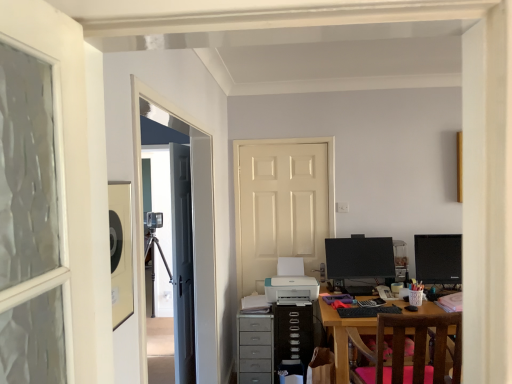
The width and height of the screenshot is (512, 384). Identify the location of white glossy door at center, acting as the second door starting from the left. (282, 207).

In order to face white glossy door at center, the first door viewed from the right, should I rotate leftwards or rightwards?

Rotate right and turn 3.976 degrees.

Find the location of a particular element. This screenshot has width=512, height=384. teal plastic printer at center is located at coordinates (291, 289).

What do you see at coordinates (182, 264) in the screenshot? This screenshot has height=384, width=512. I see `dark gray matte door at left, placed as the 2th door when sorted from right to left` at bounding box center [182, 264].

What do you see at coordinates (255, 349) in the screenshot?
I see `gray fabric drawer at center` at bounding box center [255, 349].

Locate an element on the screen. black glossy monitor at center, placed as the 2th computer monitor when sorted from right to left is located at coordinates (359, 261).

The image size is (512, 384). Describe the element at coordinates (359, 261) in the screenshot. I see `black glossy monitor at center, placed as the first computer monitor when sorted from left to right` at that location.

In order to face black glossy monitor at right, acting as the second computer monitor starting from the left, should I rotate leftwards or rightwards?

It's best to rotate right around 23.466 degrees.

Locate an element on the screen. white glossy door at center, the first door viewed from the right is located at coordinates (282, 207).

Is transparent glass door at upper left positioned far away from dark gray matte door at left, marked as the 1th door in a left-to-right arrangement?

No, transparent glass door at upper left is not far away from dark gray matte door at left, marked as the 1th door in a left-to-right arrangement.

Is transparent glass door at upper left closer to the viewer compared to dark gray matte door at left, placed as the 2th door when sorted from right to left?

Yes, transparent glass door at upper left is closer to the viewer.

Is transparent glass door at upper left at the left side of dark gray matte door at left, marked as the 1th door in a left-to-right arrangement?

No.

Is transparent glass door at upper left thinner than dark gray matte door at left, marked as the 1th door in a left-to-right arrangement?

In fact, transparent glass door at upper left might be wider than dark gray matte door at left, marked as the 1th door in a left-to-right arrangement.

Is white glossy door at center, the first door viewed from the right, facing away from black glossy monitor at center, placed as the 2th computer monitor when sorted from right to left?

white glossy door at center, the first door viewed from the right, is not turned away from black glossy monitor at center, placed as the 2th computer monitor when sorted from right to left.

Considering the relative positions of white glossy door at center, acting as the second door starting from the left, and black glossy monitor at center, placed as the first computer monitor when sorted from left to right, in the image provided, is white glossy door at center, acting as the second door starting from the left, to the right of black glossy monitor at center, placed as the first computer monitor when sorted from left to right, from the viewer's perspective?

No.

Identify the location of door behind the black glossy monitor at center, placed as the 2th computer monitor when sorted from right to left. (282, 207).

Where is `printer above the pink fabric chair at lower right (from a real-world perspective)`? The height and width of the screenshot is (384, 512). printer above the pink fabric chair at lower right (from a real-world perspective) is located at coordinates (291, 289).

Is teal plastic printer at center turned away from pink fabric chair at lower right?

That's not correct — teal plastic printer at center is not looking away from pink fabric chair at lower right.

Which of these two, teal plastic printer at center or pink fabric chair at lower right, is bigger?

pink fabric chair at lower right is bigger.

What's the angular difference between teal plastic printer at center and pink fabric chair at lower right's facing directions?

They differ by 179 degrees in their facing directions.

How many degrees apart are the facing directions of black glossy monitor at center, placed as the 2th computer monitor when sorted from right to left, and teal plastic printer at center?

3.15 degrees separate the facing orientations of black glossy monitor at center, placed as the 2th computer monitor when sorted from right to left, and teal plastic printer at center.

Is black glossy monitor at center, placed as the 2th computer monitor when sorted from right to left, not near teal plastic printer at center?

No, black glossy monitor at center, placed as the 2th computer monitor when sorted from right to left, is not far from teal plastic printer at center.

Is teal plastic printer at center at the back of black glossy monitor at center, placed as the 2th computer monitor when sorted from right to left?

No, black glossy monitor at center, placed as the 2th computer monitor when sorted from right to left, is not facing away from teal plastic printer at center.

Looking at this image, can you confirm if black glossy monitor at center, placed as the 2th computer monitor when sorted from right to left, is positioned to the left of teal plastic printer at center?

In fact, black glossy monitor at center, placed as the 2th computer monitor when sorted from right to left, is to the right of teal plastic printer at center.

Is black glossy monitor at right, acting as the second computer monitor starting from the left, facing towards black glossy monitor at center, placed as the first computer monitor when sorted from left to right?

No.

At what (x,y) coordinates should I click in order to perform the action: click on computer monitor on the left side of black glossy monitor at right, the 1th computer monitor positioned from the right. Please return your answer as a coordinate pair (x, y). Looking at the image, I should click on (359, 261).

Visually, is black glossy monitor at right, the 1th computer monitor positioned from the right, positioned to the left or to the right of black glossy monitor at center, placed as the 2th computer monitor when sorted from right to left?

Based on their positions, black glossy monitor at right, the 1th computer monitor positioned from the right, is located to the right of black glossy monitor at center, placed as the 2th computer monitor when sorted from right to left.

Which is in front, dark gray matte door at left, marked as the 1th door in a left-to-right arrangement, or white glossy door at center, the first door viewed from the right?

dark gray matte door at left, marked as the 1th door in a left-to-right arrangement.

Is dark gray matte door at left, marked as the 1th door in a left-to-right arrangement, directly adjacent to white glossy door at center, acting as the second door starting from the left?

No, dark gray matte door at left, marked as the 1th door in a left-to-right arrangement, is not beside white glossy door at center, acting as the second door starting from the left.

Does dark gray matte door at left, marked as the 1th door in a left-to-right arrangement, appear on the left side of white glossy door at center, acting as the second door starting from the left?

Correct, you'll find dark gray matte door at left, marked as the 1th door in a left-to-right arrangement, to the left of white glossy door at center, acting as the second door starting from the left.

Is dark gray matte door at left, placed as the 2th door when sorted from right to left, smaller than white glossy door at center, acting as the second door starting from the left?

No, dark gray matte door at left, placed as the 2th door when sorted from right to left, is not smaller than white glossy door at center, acting as the second door starting from the left.

Is the position of pink fabric chair at lower right less distant than that of gray fabric drawer at center?

Yes.

Is pink fabric chair at lower right facing away from gray fabric drawer at center?

No.

Between pink fabric chair at lower right and gray fabric drawer at center, which one has larger width?

pink fabric chair at lower right is wider.

The width and height of the screenshot is (512, 384). What are the coordinates of `drawer lying behind the pink fabric chair at lower right` in the screenshot? It's located at (255, 349).

This screenshot has width=512, height=384. Identify the location of screen door that is in front of the dark gray matte door at left, marked as the 1th door in a left-to-right arrangement. (193, 225).

Find the location of a particular element. The width and height of the screenshot is (512, 384). the 1st door to the left of the black glossy monitor at center, placed as the first computer monitor when sorted from left to right, starting your count from the anchor is located at coordinates (282, 207).

Looking at the image, which one is located further to black glossy monitor at center, placed as the 2th computer monitor when sorted from right to left, white glossy door at center, acting as the second door starting from the left, or teal plastic printer at center?

white glossy door at center, acting as the second door starting from the left, is positioned further to the anchor black glossy monitor at center, placed as the 2th computer monitor when sorted from right to left.

Looking at this image, considering their positions, is teal plastic printer at center positioned further to white glossy door at center, acting as the second door starting from the left, than transparent glass door at upper left?

transparent glass door at upper left.

When comparing their distances from pink fabric chair at lower right, does transparent glass door at upper left or teal plastic printer at center seem closer?

teal plastic printer at center.

Looking at the image, which one is located closer to gray fabric drawer at center, dark gray matte door at left, placed as the 2th door when sorted from right to left, or pink fabric chair at lower right?

Among the two, dark gray matte door at left, placed as the 2th door when sorted from right to left, is located nearer to gray fabric drawer at center.

When comparing their distances from gray fabric drawer at center, does transparent glass door at upper left or black glossy monitor at right, the 1th computer monitor positioned from the right, seem closer?

Among the two, transparent glass door at upper left is located nearer to gray fabric drawer at center.

From the image, which object appears to be nearer to dark gray matte door at left, placed as the 2th door when sorted from right to left, gray fabric drawer at center or white glossy door at center, acting as the second door starting from the left?

gray fabric drawer at center is positioned closer to the anchor dark gray matte door at left, placed as the 2th door when sorted from right to left.

Looking at the image, which one is located further to teal plastic printer at center, black glossy monitor at right, acting as the second computer monitor starting from the left, or white glossy door at center, the first door viewed from the right?

Based on the image, black glossy monitor at right, acting as the second computer monitor starting from the left, appears to be further to teal plastic printer at center.

Considering their positions, is teal plastic printer at center positioned closer to gray fabric drawer at center than black glossy monitor at center, placed as the first computer monitor when sorted from left to right?

The object closer to gray fabric drawer at center is teal plastic printer at center.

Identify the location of door between dark gray matte door at left, marked as the 1th door in a left-to-right arrangement, and black glossy monitor at right, acting as the second computer monitor starting from the left, from left to right. The height and width of the screenshot is (384, 512). (282, 207).

I want to click on printer located between dark gray matte door at left, marked as the 1th door in a left-to-right arrangement, and black glossy monitor at right, acting as the second computer monitor starting from the left, in the left-right direction, so click(x=291, y=289).

I want to click on computer monitor between transparent glass door at upper left and black glossy monitor at center, placed as the 2th computer monitor when sorted from right to left, in the front-back direction, so click(x=438, y=259).

Where is `chair between transparent glass door at upper left and dark gray matte door at left, placed as the 2th door when sorted from right to left, in the front-back direction`? chair between transparent glass door at upper left and dark gray matte door at left, placed as the 2th door when sorted from right to left, in the front-back direction is located at coordinates (414, 349).